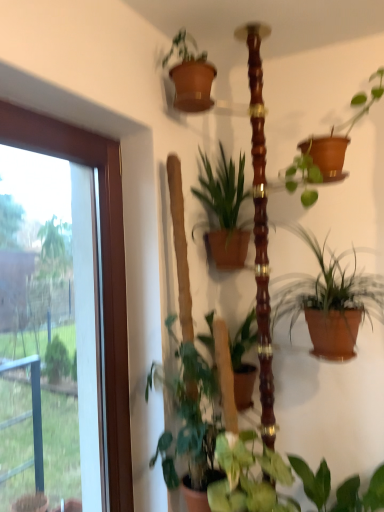
Question: From a real-world perspective, is green matte plant at lower left, which is the third houseplant in top-to-bottom order, positioned under green matte plant at center, which ranks as the 4th houseplant in bottom-to-top order, based on gravity?

Choices:
 (A) yes
 (B) no

Answer: (A)

Question: Considering the relative sizes of green matte plant at lower left, which is the 2th houseplant in bottom-to-top order, and green matte plant at center, the 1th houseplant positioned from the top, in the image provided, is green matte plant at lower left, which is the 2th houseplant in bottom-to-top order, shorter than green matte plant at center, the 1th houseplant positioned from the top,?

Choices:
 (A) no
 (B) yes

Answer: (A)

Question: Does green matte plant at lower left, which is the third houseplant in top-to-bottom order, appear on the left side of green matte plant at center, which ranks as the 4th houseplant in bottom-to-top order?

Choices:
 (A) yes
 (B) no

Answer: (A)

Question: Would you say green matte plant at lower left, which is the third houseplant in top-to-bottom order, is a long distance from green matte plant at center, which ranks as the 4th houseplant in bottom-to-top order?

Choices:
 (A) no
 (B) yes

Answer: (A)

Question: From the image's perspective, is green matte plant at lower left, which is the 2th houseplant in bottom-to-top order, below green matte plant at center, which ranks as the 4th houseplant in bottom-to-top order?

Choices:
 (A) yes
 (B) no

Answer: (A)

Question: From a real-world perspective, is green matte plant at lower left, which is the 2th houseplant in bottom-to-top order, on green matte plant at center, the 1th houseplant positioned from the top?

Choices:
 (A) no
 (B) yes

Answer: (A)

Question: Does green matte plant at lower left, which is the third houseplant in top-to-bottom order, have a smaller size compared to green glossy plant at center, positioned as the 1th houseplant in bottom-to-top order?

Choices:
 (A) no
 (B) yes

Answer: (A)

Question: Does green matte plant at lower left, which is the 2th houseplant in bottom-to-top order, appear on the right side of green glossy plant at center, positioned as the 1th houseplant in bottom-to-top order?

Choices:
 (A) no
 (B) yes

Answer: (A)

Question: From a real-world perspective, is green matte plant at lower left, which is the third houseplant in top-to-bottom order, located higher than green glossy plant at center, positioned as the 1th houseplant in bottom-to-top order?

Choices:
 (A) no
 (B) yes

Answer: (B)

Question: Does green matte plant at lower left, which is the 2th houseplant in bottom-to-top order, have a lesser height compared to green glossy plant at center, arranged as the fourth houseplant when viewed from the top?

Choices:
 (A) yes
 (B) no

Answer: (B)

Question: From the image's perspective, is green matte plant at lower left, which is the third houseplant in top-to-bottom order, over green glossy plant at center, arranged as the fourth houseplant when viewed from the top?

Choices:
 (A) yes
 (B) no

Answer: (A)

Question: Considering the relative positions of green matte plant at lower left, which is the 2th houseplant in bottom-to-top order, and green glossy plant at center, positioned as the 1th houseplant in bottom-to-top order, in the image provided, is green matte plant at lower left, which is the 2th houseplant in bottom-to-top order, to the left of green glossy plant at center, positioned as the 1th houseplant in bottom-to-top order, from the viewer's perspective?

Choices:
 (A) yes
 (B) no

Answer: (A)

Question: Is green matte plant at lower left, which is the third houseplant in top-to-bottom order, placed right next to terracotta clay pot at center-right, which is the 3th houseplant from bottom to top?

Choices:
 (A) yes
 (B) no

Answer: (B)